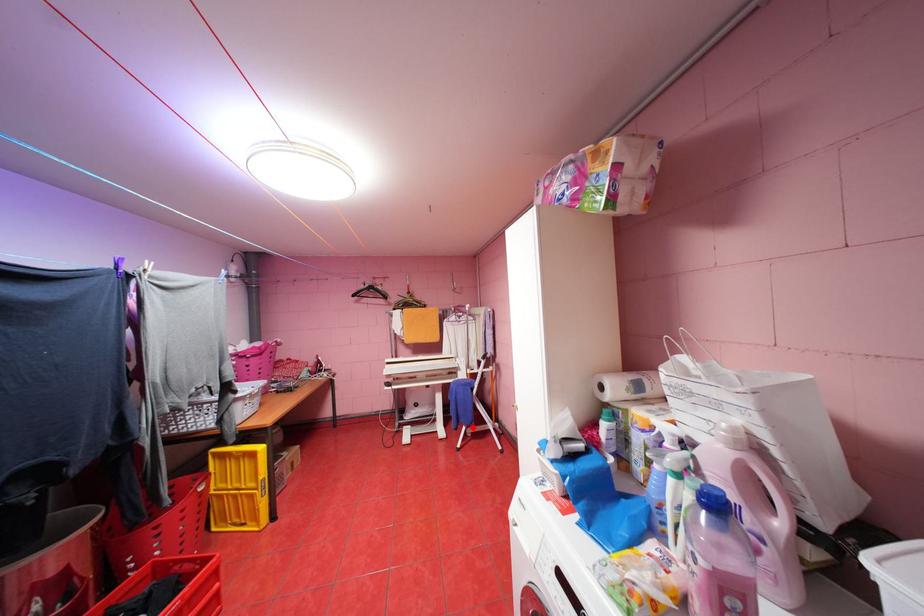
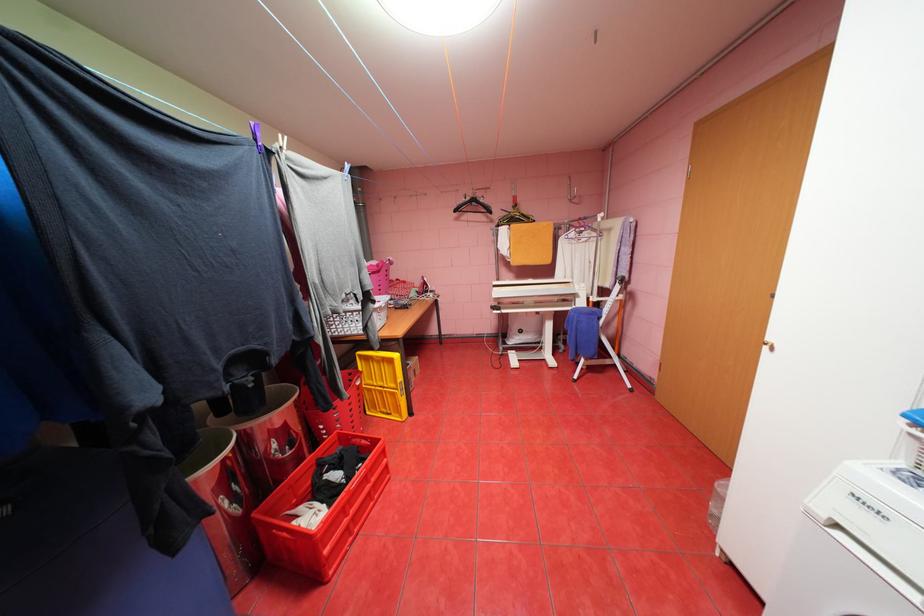
Question: I am providing you with two images of the same scene from different viewpoints. A red point is shown in image1. For the corresponding object point in image2, is it positioned nearer or farther from the camera?

Choices:
 (A) Nearer
 (B) Farther

Answer: (A)